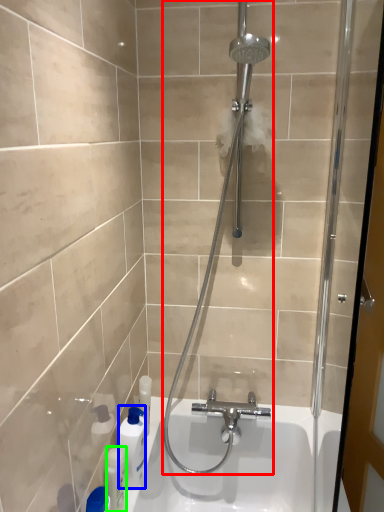
Question: Estimate the real-world distances between objects in this image. Which object is farther from shower (highlighted by a red box), cleaning product (highlighted by a blue box) or toiletry (highlighted by a green box)?

Choices:
 (A) cleaning product
 (B) toiletry

Answer: (B)